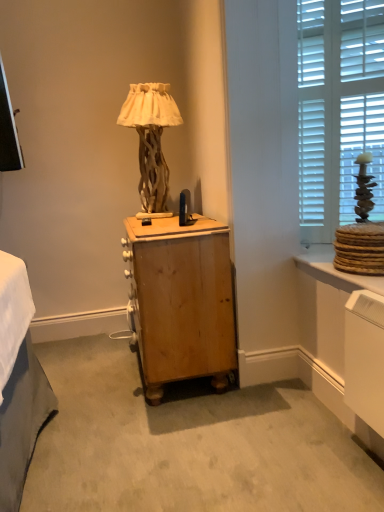
Identify the location of vacant area that is in front of matte wood vanity at lower right. Image resolution: width=384 pixels, height=512 pixels. (331, 459).